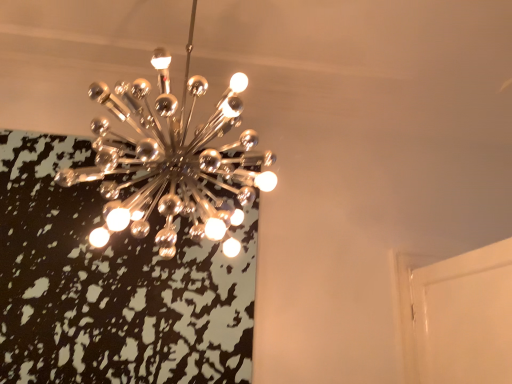
What do you see at coordinates (172, 160) in the screenshot? I see `metallic chandelier at upper left` at bounding box center [172, 160].

Locate an element on the screen. metallic chandelier at upper left is located at coordinates (172, 160).

Identify the location of metallic chandelier at upper left. (172, 160).